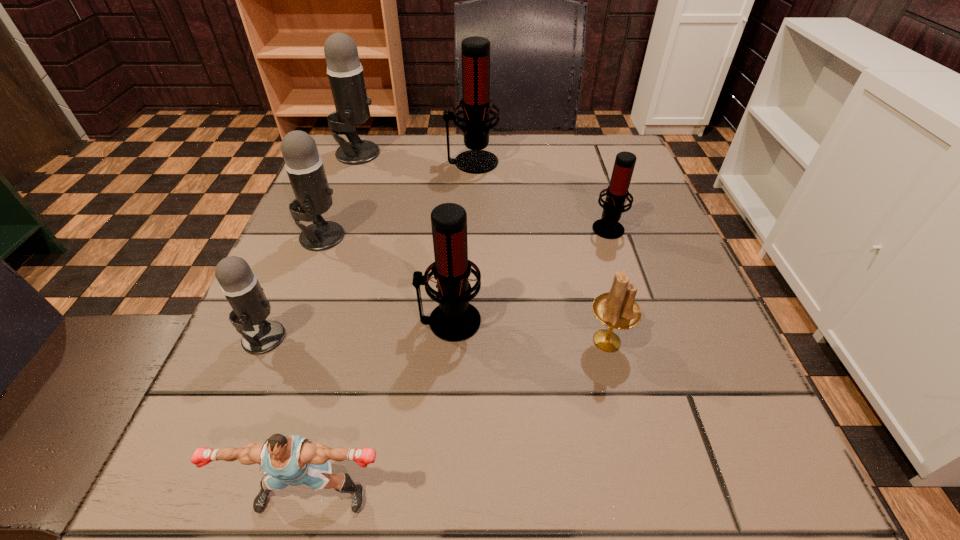
At what (x,y) coordinates should I click in order to perform the action: click on free space that is in between the candle holder and the smallest gray microphone. Please return your answer as a coordinate pair (x, y). The width and height of the screenshot is (960, 540). Looking at the image, I should click on (435, 339).

The height and width of the screenshot is (540, 960). I want to click on vacant point located between the biggest red microphone and the candle holder, so click(540, 252).

Locate an element on the screen. This screenshot has height=540, width=960. free point between the nearest gray microphone and the candle holder is located at coordinates (435, 339).

What are the coordinates of `vacant area that lies between the rightmost microphone and the nearest object` in the screenshot? It's located at [x=460, y=361].

Where is `empty space that is in between the farthest red microphone and the second farthest gray microphone`? The width and height of the screenshot is (960, 540). empty space that is in between the farthest red microphone and the second farthest gray microphone is located at coordinates (396, 199).

Where is `vacant space in between the farthest red microphone and the candle holder`? This screenshot has height=540, width=960. vacant space in between the farthest red microphone and the candle holder is located at coordinates (540, 252).

Image resolution: width=960 pixels, height=540 pixels. In order to click on vacant area that lies between the rightmost red microphone and the candle holder in this screenshot , I will do `click(607, 284)`.

Where is `empty space that is in between the second farthest red microphone and the farthest gray microphone`? empty space that is in between the second farthest red microphone and the farthest gray microphone is located at coordinates (483, 190).

Identify the location of free space between the second biggest red microphone and the candle holder. (528, 331).

Select which object is the third closest to the farthest gray microphone. Please provide its 2D coordinates. Your answer should be formatted as a tuple, i.e. [(x, y)], where the tuple contains the x and y coordinates of a point satisfying the conditions above.

[(455, 319)]